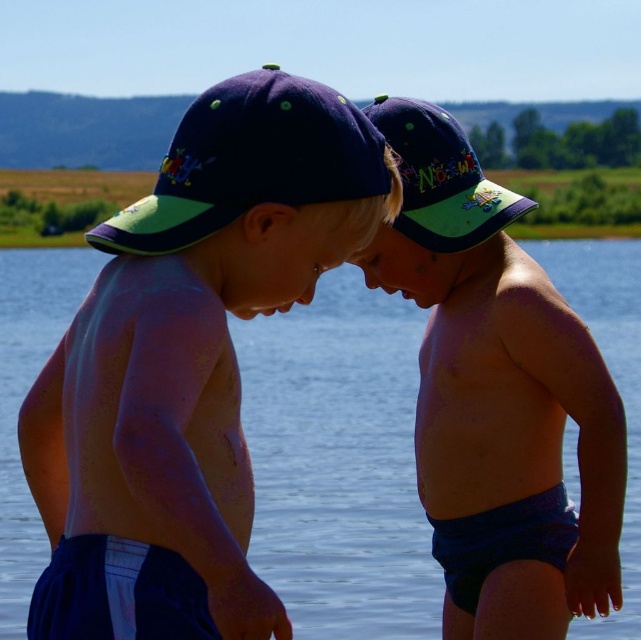
Question: Based on their relative distances, which object is nearer to the navy blue fabric cap at upper center?

Choices:
 (A) matte blue shorts at center
 (B) matte blue cap at left
 (C) matte blue cap at center
 (D) transparent blue water at center

Answer: (B)

Question: Is matte blue cap at left above transparent blue water at center?

Choices:
 (A) no
 (B) yes

Answer: (B)

Question: Where is matte blue shorts at center located in relation to matte blue cap at center in the image?

Choices:
 (A) above
 (B) below

Answer: (B)

Question: Does transparent blue water at center have a lesser width compared to matte blue shorts at center?

Choices:
 (A) no
 (B) yes

Answer: (A)

Question: Which point appears closest to the camera in this image?

Choices:
 (A) (437, 285)
 (B) (169, 509)
 (C) (221, 132)

Answer: (B)

Question: Which point is closer to the camera?

Choices:
 (A) (22, 611)
 (B) (451, 208)

Answer: (B)